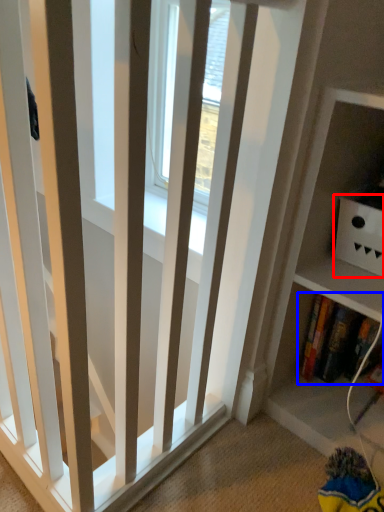
Question: Among these objects, which one is farthest to the camera, cabinet (highlighted by a red box) or book (highlighted by a blue box)?

Choices:
 (A) cabinet
 (B) book

Answer: (B)